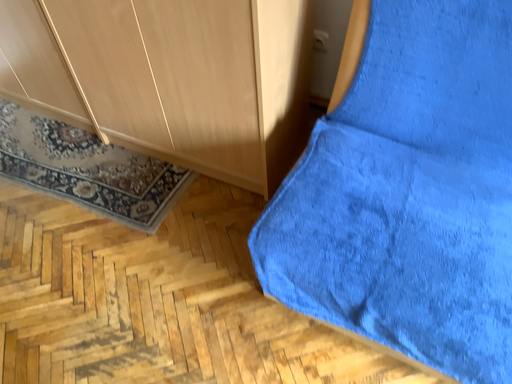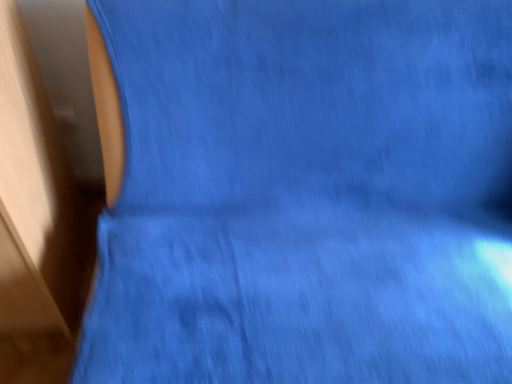
Question: How did the camera likely rotate when shooting the video?

Choices:
 (A) rotated right
 (B) rotated left

Answer: (A)